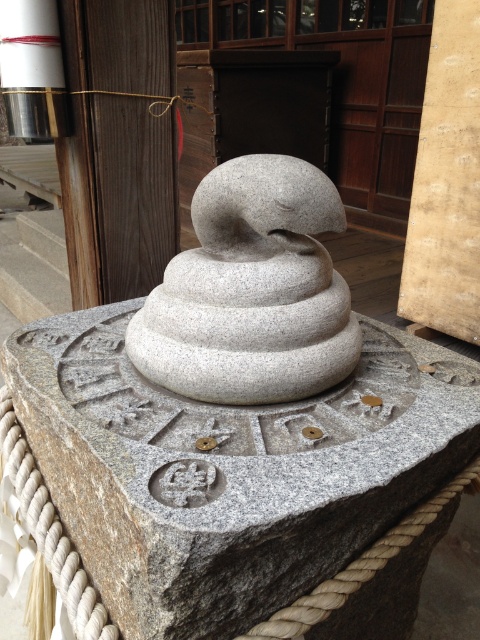
Who is shorter, gray stone sculpture at center or smooth beige stone at right?

With less height is gray stone sculpture at center.

Which is more to the right, gray stone sculpture at center or smooth beige stone at right?

From the viewer's perspective, smooth beige stone at right appears more on the right side.

You are a GUI agent. You are given a task and a screenshot of the screen. Output one action in this format:
    pyautogui.click(x=<x>, y=<y>)
    Task: Click on the gray stone sculpture at center
    This screenshot has width=480, height=640.
    Given the screenshot: What is the action you would take?
    pyautogui.click(x=252, y=291)

What do you see at coordinates (228, 470) in the screenshot? I see `gray stone snake at center` at bounding box center [228, 470].

Is gray stone snake at center in front of gray stone sculpture at center?

Yes.

Image resolution: width=480 pixels, height=640 pixels. Find the location of `gray stone snake at center`. gray stone snake at center is located at coordinates (228, 470).

Between smooth wooden pillar at upper left and smooth beige stone at right, which one appears on the left side from the viewer's perspective?

smooth wooden pillar at upper left is more to the left.

Locate an element on the screen. This screenshot has height=640, width=480. smooth wooden pillar at upper left is located at coordinates (118, 147).

At what (x,y) coordinates should I click in order to perform the action: click on smooth wooden pillar at upper left. Please return your answer as a coordinate pair (x, y). Image resolution: width=480 pixels, height=640 pixels. Looking at the image, I should click on (118, 147).